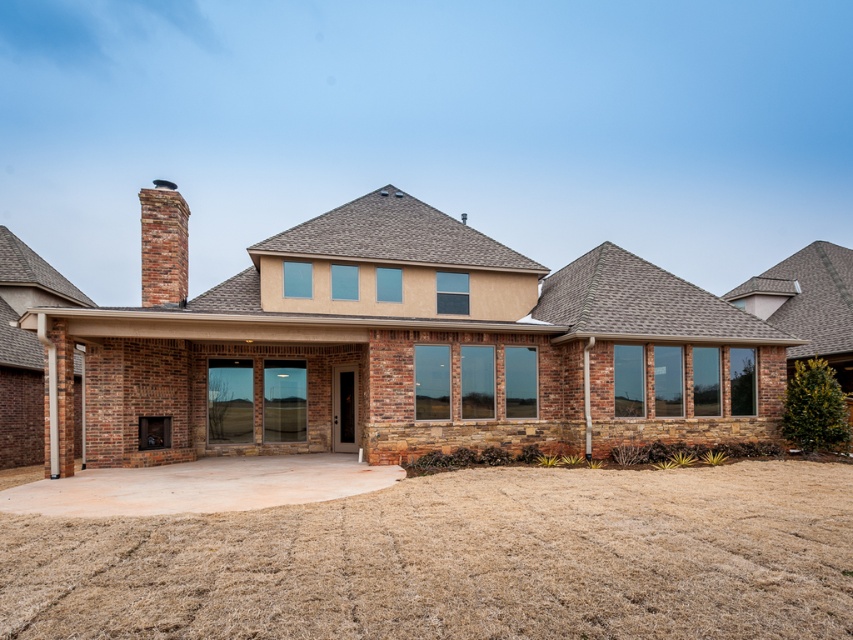
Question: Does concrete at center come behind brick chimney at upper left?

Choices:
 (A) no
 (B) yes

Answer: (A)

Question: Which point is closer to the camera?

Choices:
 (A) (83, 516)
 (B) (142, 189)

Answer: (A)

Question: Which of the following is the farthest from the observer?

Choices:
 (A) (178, 256)
 (B) (184, 609)
 (C) (184, 502)

Answer: (A)

Question: Does concrete at center appear over brick chimney at upper left?

Choices:
 (A) yes
 (B) no

Answer: (B)

Question: Which object is the farthest from the brick chimney at upper left?

Choices:
 (A) concrete at center
 (B) smooth concrete driveway at center

Answer: (A)

Question: Does concrete at center lie behind smooth concrete driveway at center?

Choices:
 (A) yes
 (B) no

Answer: (B)